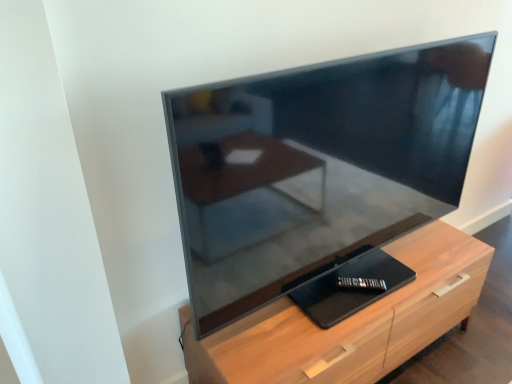
Find the location of a particular element. free location above light wood chest of drawers at center (from a real-world perspective) is located at coordinates (347, 289).